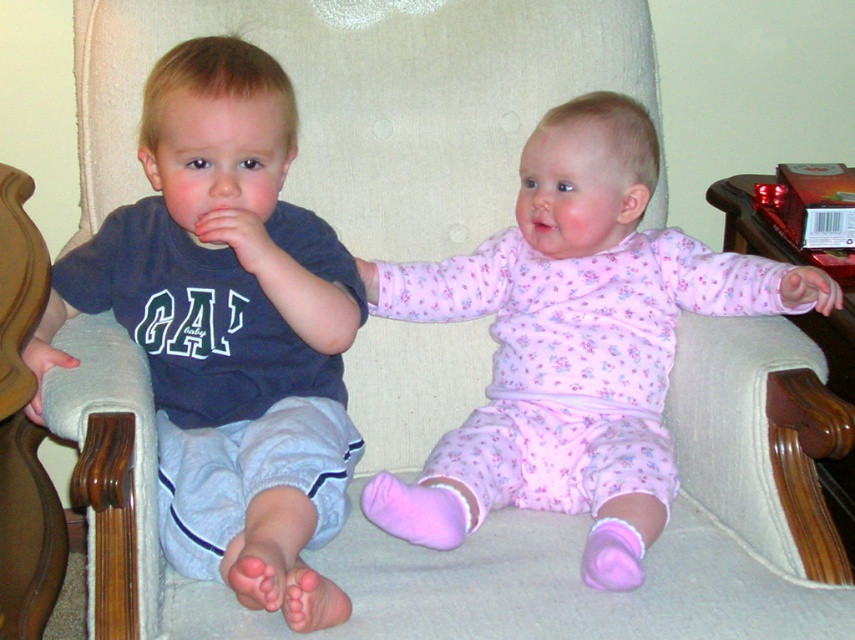
Question: Does matte blue shirt at left appear on the right side of pink floral pajamas at center?

Choices:
 (A) no
 (B) yes

Answer: (A)

Question: Can you confirm if matte blue shirt at left is thinner than pink floral pajamas at center?

Choices:
 (A) yes
 (B) no

Answer: (A)

Question: Does matte blue shirt at left appear on the left side of pink floral pajamas at center?

Choices:
 (A) no
 (B) yes

Answer: (B)

Question: Which object is farther from the camera taking this photo?

Choices:
 (A) matte blue shirt at left
 (B) pink floral pajamas at center

Answer: (B)